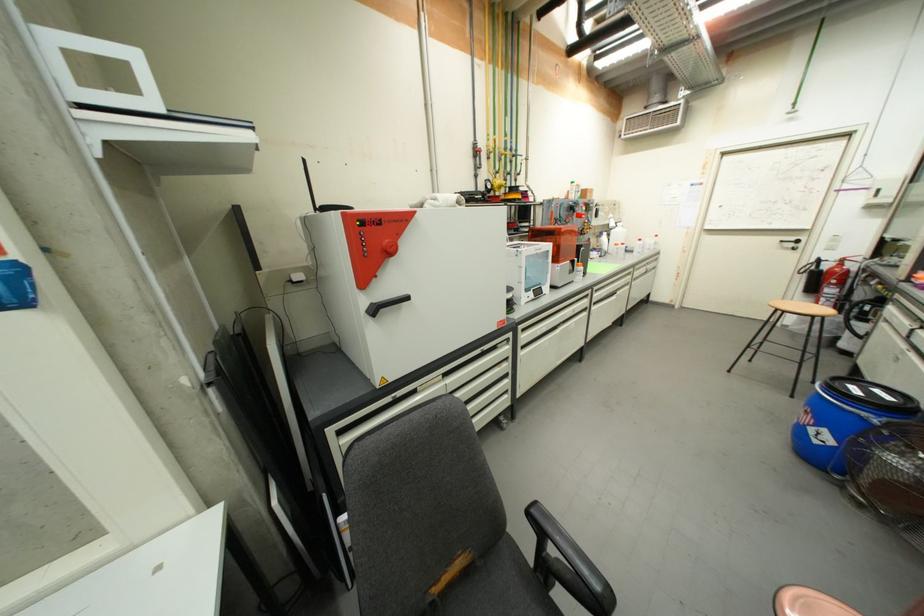
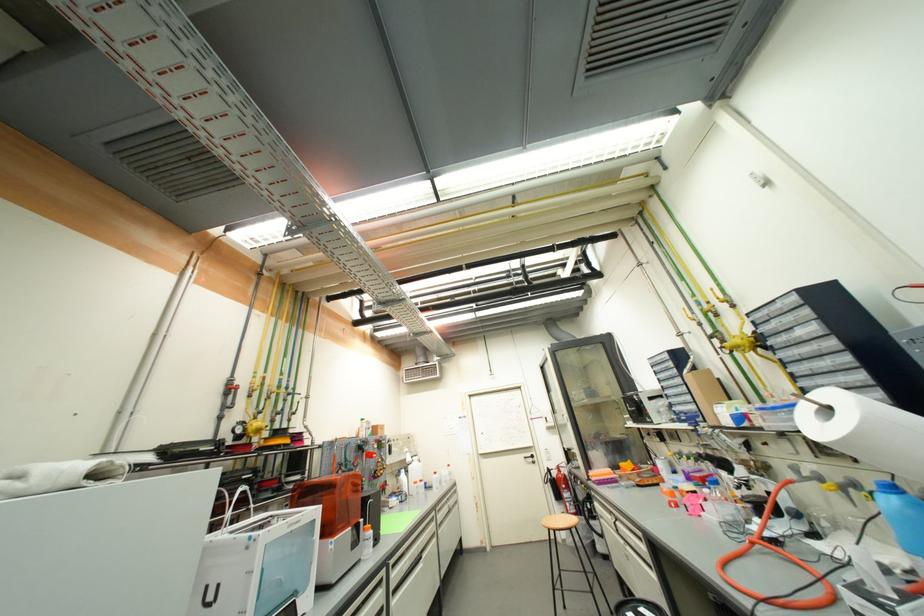
In the second image, find the point that corresponds to the point at 840,296 in the first image.

(575, 500)